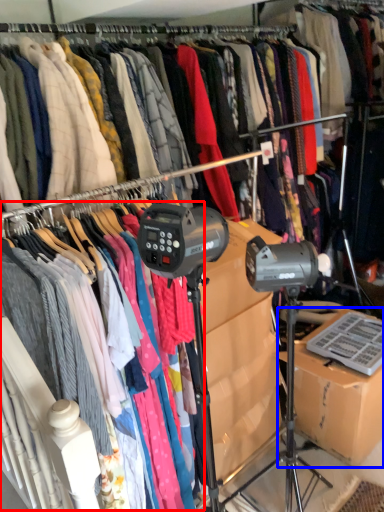
Question: Among these objects, which one is nearest to the camera, clothing (highlighted by a red box) or cardboard box (highlighted by a blue box)?

Choices:
 (A) clothing
 (B) cardboard box

Answer: (A)